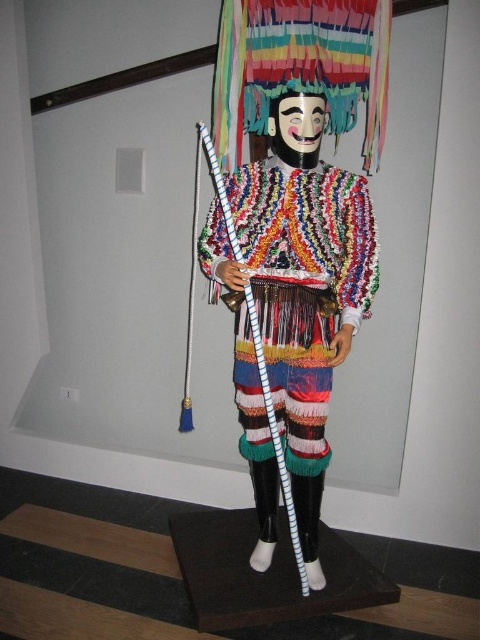
Question: Can you confirm if knitted/multicolored figure at center is positioned to the left of knitted multicolored sweater at center?

Choices:
 (A) yes
 (B) no

Answer: (A)

Question: Is knitted/multicolored figure at center smaller than knitted multicolored sweater at center?

Choices:
 (A) no
 (B) yes

Answer: (A)

Question: Where is knitted/multicolored figure at center located in relation to knitted multicolored sweater at center in the image?

Choices:
 (A) above
 (B) below

Answer: (A)

Question: Which of the following is the closest to the observer?

Choices:
 (A) knitted multicolored sweater at center
 (B) knitted/multicolored figure at center

Answer: (B)